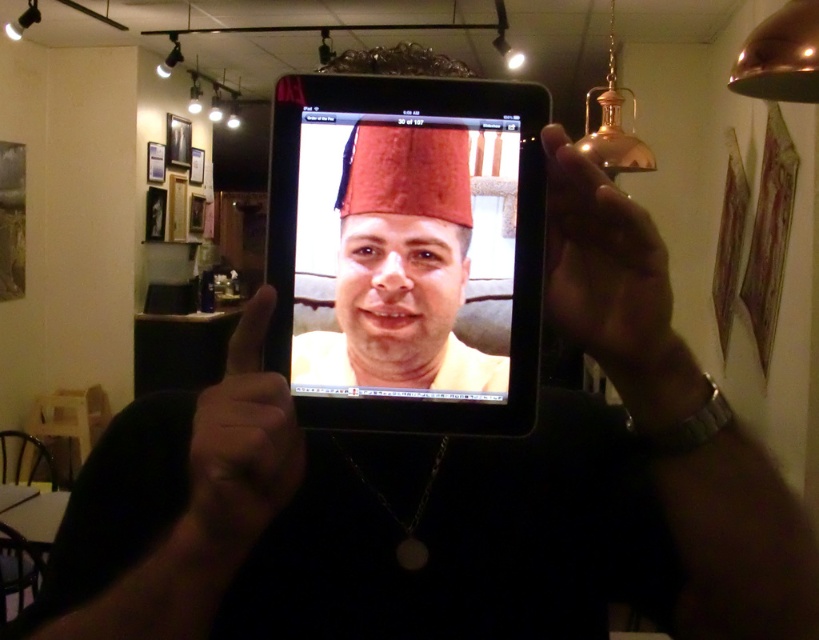
Between matte black tablet at center and matte black hand at center, which one is positioned lower?

matte black hand at center is below.

Describe the element at coordinates (405, 250) in the screenshot. I see `matte black tablet at center` at that location.

You are a GUI agent. You are given a task and a screenshot of the screen. Output one action in this format:
    pyautogui.click(x=<x>, y=<y>)
    Task: Click on the matte black tablet at center
    The height and width of the screenshot is (640, 819).
    Given the screenshot: What is the action you would take?
    pyautogui.click(x=405, y=250)

Can you confirm if matte black tablet at center is taller than gold metallic hand at upper right?

Yes, matte black tablet at center is taller than gold metallic hand at upper right.

Find the location of `matte black tablet at center`. matte black tablet at center is located at coordinates (405, 250).

Is point (390, 163) positioned behind point (577, 243)?

No, it is in front of (577, 243).

Where is `matte black tablet at center`? matte black tablet at center is located at coordinates (405, 250).

Does gold metallic hand at upper right appear on the left side of matte black hand at center?

Incorrect, gold metallic hand at upper right is not on the left side of matte black hand at center.

Measure the distance between point (577, 260) and camera.

Point (577, 260) is 18.14 inches away from camera.

Locate an element on the screen. The image size is (819, 640). gold metallic hand at upper right is located at coordinates (603, 266).